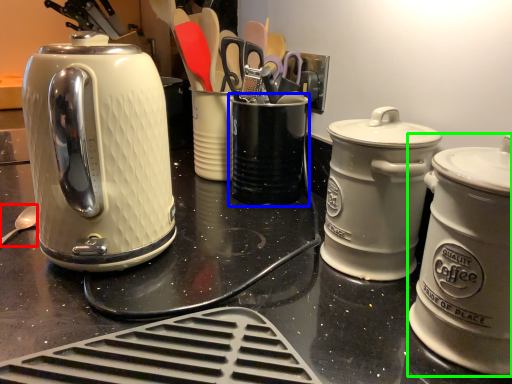
Question: Based on their relative distances, which object is farther from spoon (highlighted by a red box)? Choose from appliance (highlighted by a blue box) and kitchen appliance (highlighted by a green box).

Choices:
 (A) appliance
 (B) kitchen appliance

Answer: (B)